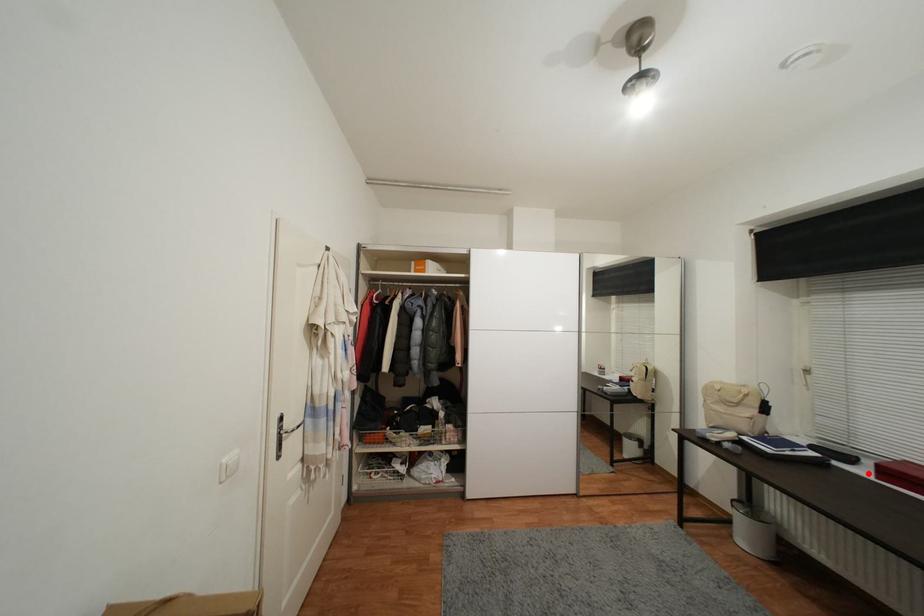
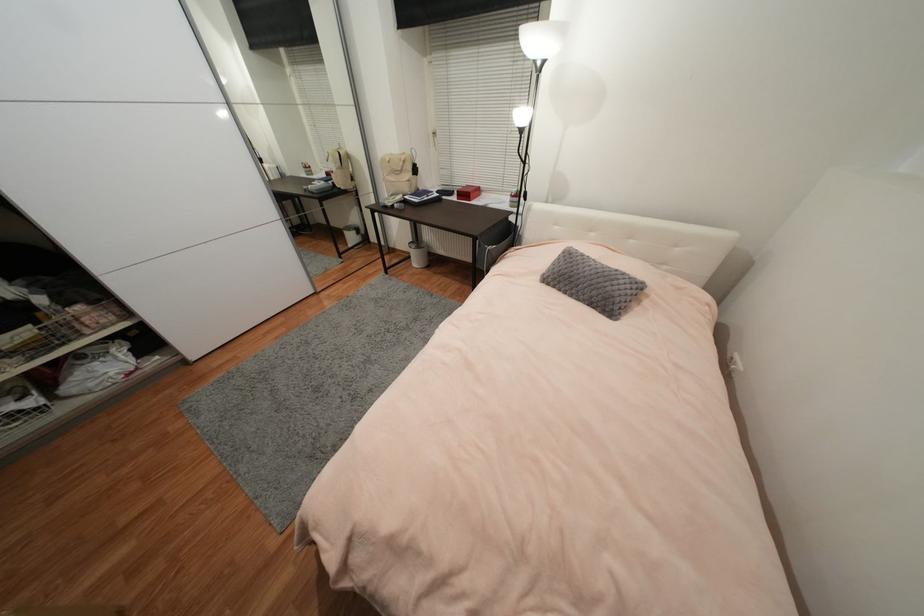
Where in the second image is the point corresponding to the highlighted location from the first image?

(458, 199)